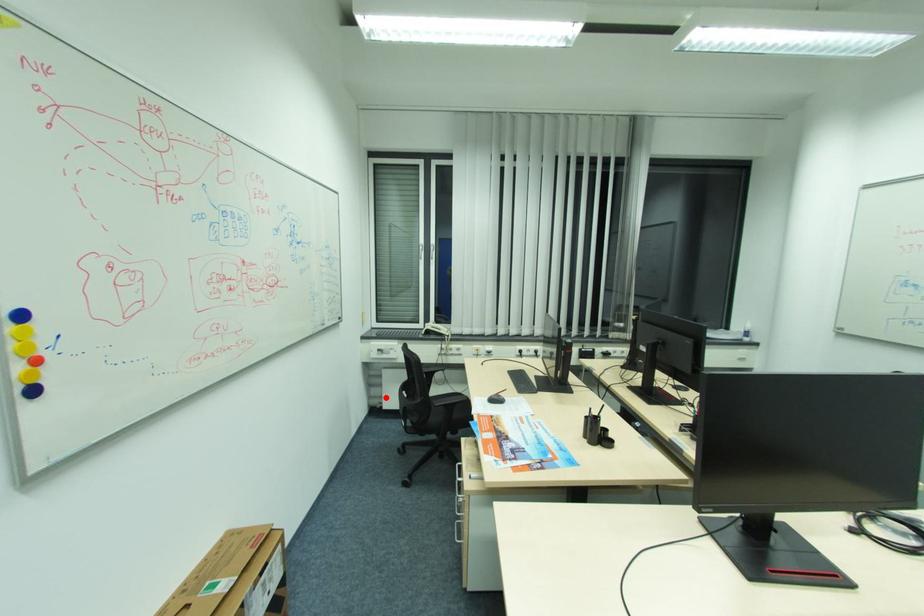
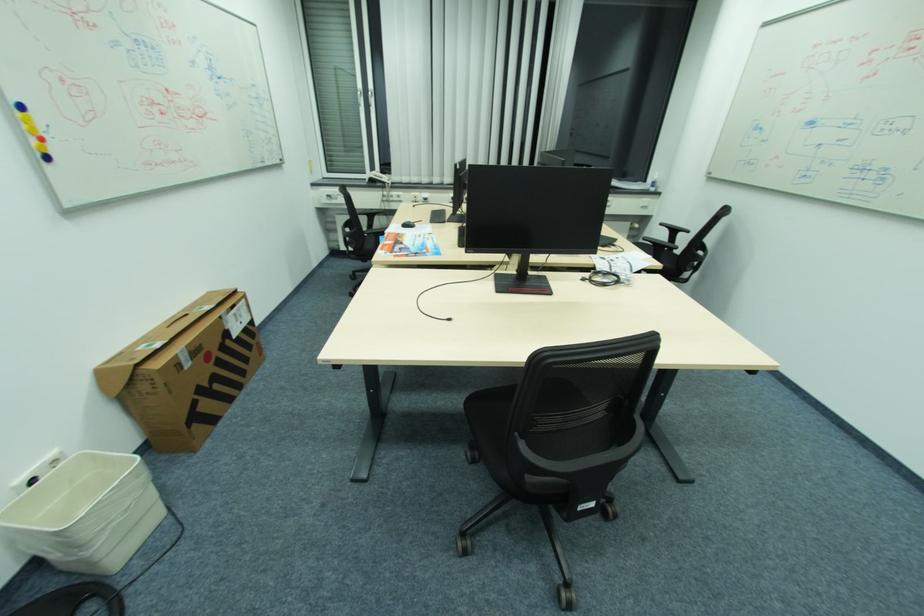
Question: I am providing you with two images of the same scene from different viewpoints. A red point is marked on the first image. At the location where the point appears in image 1, is it still visible in image 2?

Choices:
 (A) Yes
 (B) No

Answer: (A)